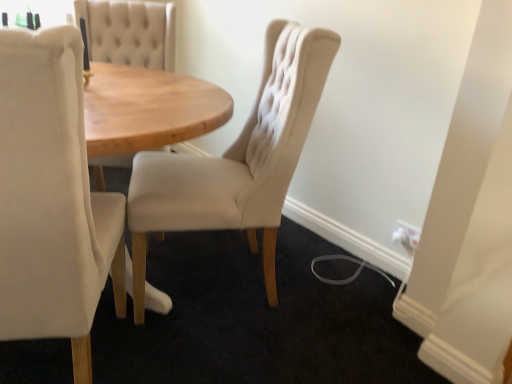
You are a GUI agent. You are given a task and a screenshot of the screen. Output one action in this format:
    pyautogui.click(x=<x>, y=<y>)
    Task: Click on the vacant space underneath beige fabric chair at center, which is the second chair from left to right (from a real-world perspective)
    Image resolution: width=512 pixels, height=384 pixels.
    Given the screenshot: What is the action you would take?
    pyautogui.click(x=208, y=279)